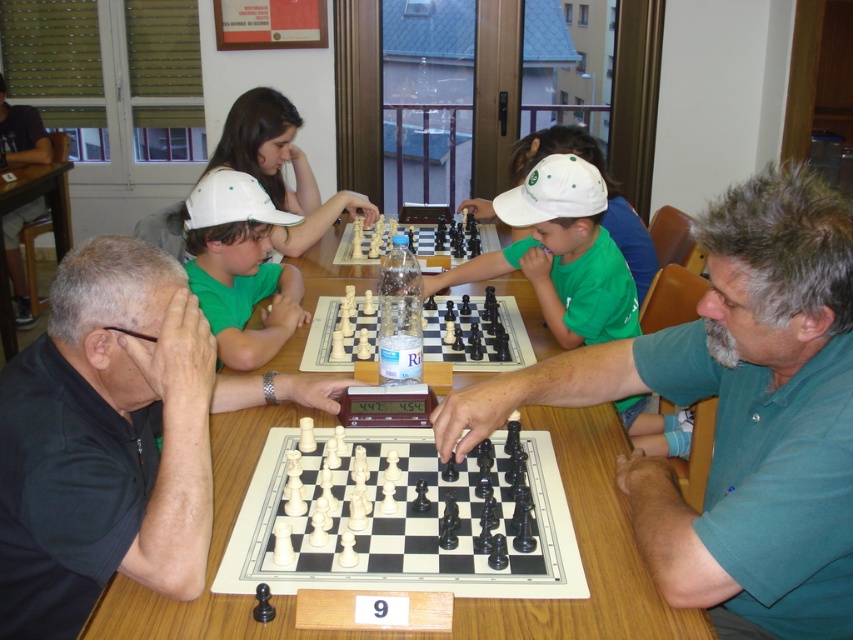
You are a photographer standing 5 feet away from the table where the chess match is happening. You want to take a photo that captures both the matte black chess set at center and the matte green cap at center in the same frame. Based on their positions, will you be able to fit both objects into your camera viewfinder without moving closer or farther away?

The matte black chess set at center and matte green cap at center are 36.54 inches apart from each other. Since the photographer is 5 feet away, which is 60 inches, the distance between the objects is less than the photographer distance, so both objects can be captured in the same frame without moving closer or farther away.

You are a photographer taking a picture of the chess match. You want to focus on the point closer to the camera between point (346,195) and point (344,214). Which point should you focus on?

Point (346,195) is closer to the camera than point (344,214), so you should focus on point (346,195).

You are a chess player trying to place a new chess piece on the table. The white plastic chessboard at center has a limited space. Can you fit the white matte cap at center on the chessboard without overlapping?

The white plastic chessboard at center is bigger than the white matte cap at center, so yes, the white matte cap at center can be placed on the chessboard without overlapping.